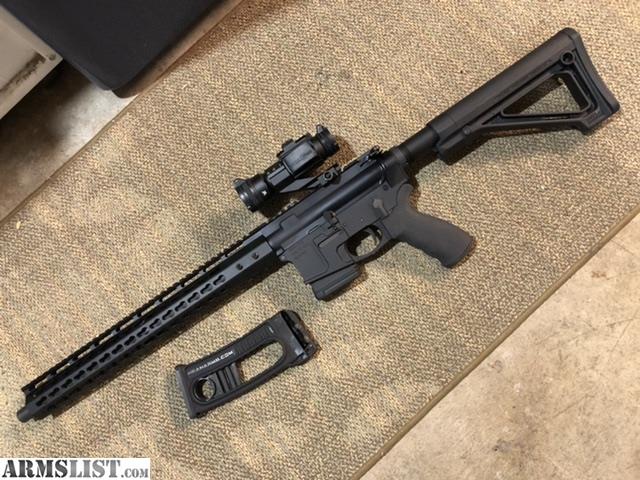
Find the location of a particular element. The image size is (640, 480). magazine is located at coordinates (228, 391).